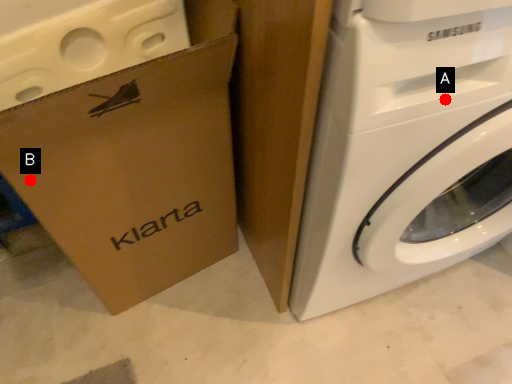
Question: Two points are circled on the image, labeled by A and B beside each circle. Among these points, which one is farthest from the camera?

Choices:
 (A) A is further
 (B) B is further

Answer: (B)